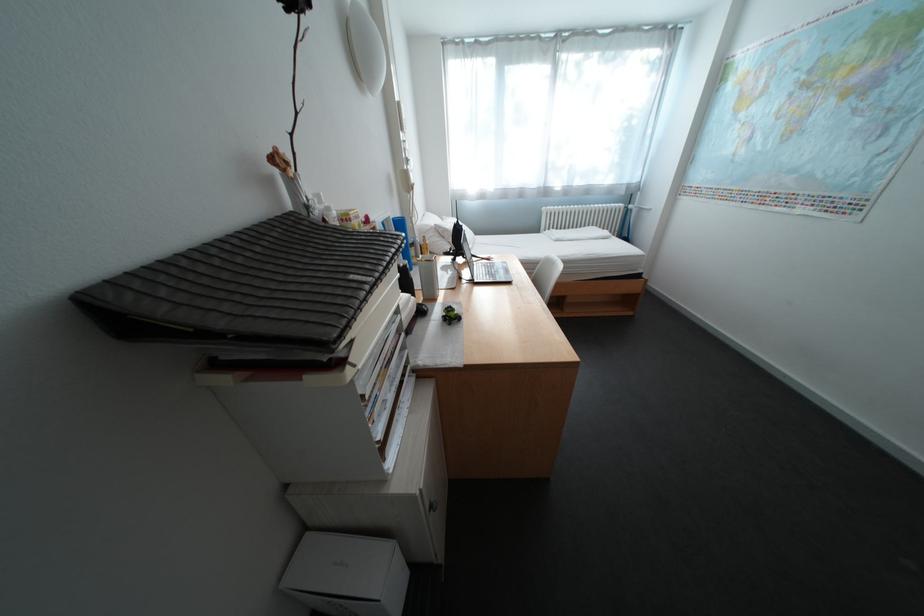
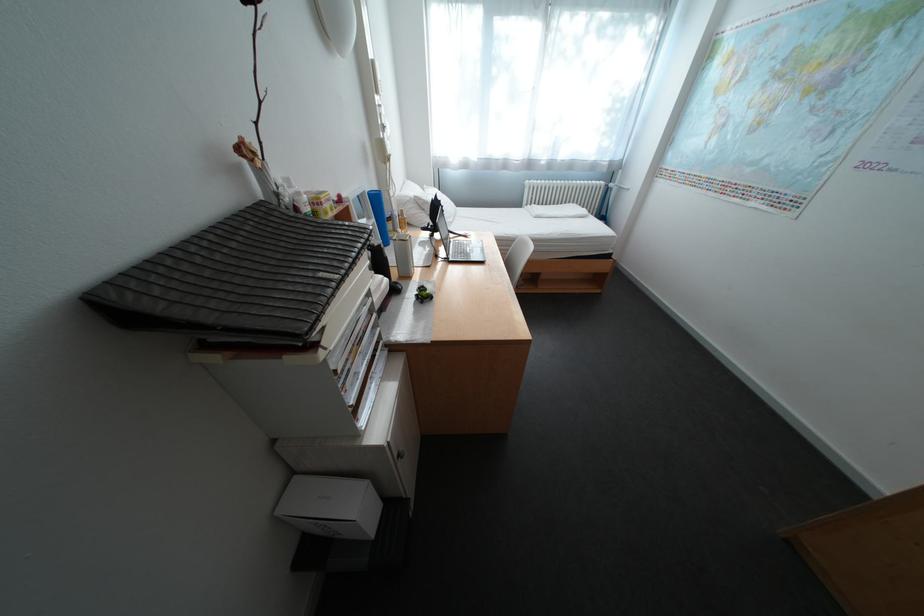
The point at (320, 536) is marked in the first image. Where is the corresponding point in the second image?

(308, 479)